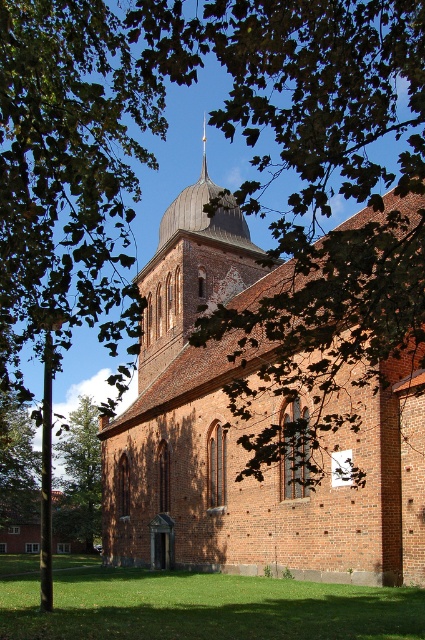
Does green leafy tree at lower left have a smaller size compared to gold/ornate spire at upper center?

No, green leafy tree at lower left is not smaller than gold/ornate spire at upper center.

Does green leafy tree at lower left appear under gold/ornate spire at upper center?

Yes.

Find the location of a particular element. This screenshot has height=640, width=425. green leafy tree at lower left is located at coordinates (79, 476).

I want to click on green leafy tree at lower left, so click(79, 476).

Does brown brick church at center have a lesser height compared to gold/ornate spire at upper center?

In fact, brown brick church at center may be taller than gold/ornate spire at upper center.

How much distance is there between brown brick church at center and gold/ornate spire at upper center?

brown brick church at center is 43.45 meters from gold/ornate spire at upper center.

Who is more forward, (424, 440) or (204, 154)?

Point (424, 440) is in front.

I want to click on brown brick church at center, so click(240, 432).

The image size is (425, 640). What do you see at coordinates (240, 432) in the screenshot?
I see `brown brick church at center` at bounding box center [240, 432].

What are the coordinates of `brown brick church at center` in the screenshot? It's located at (240, 432).

The width and height of the screenshot is (425, 640). What do you see at coordinates (240, 432) in the screenshot?
I see `brown brick church at center` at bounding box center [240, 432].

The image size is (425, 640). In order to click on brown brick church at center in this screenshot , I will do `click(240, 432)`.